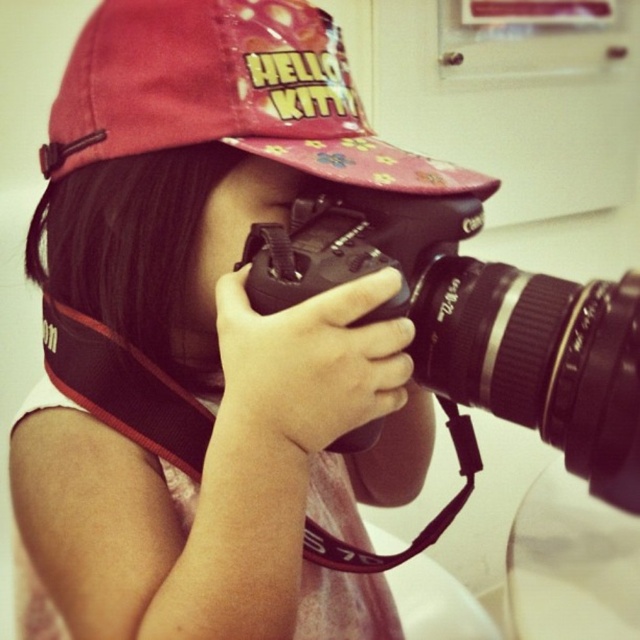
Find the location of a particular element. The image size is (640, 640). black plastic camera at center is located at coordinates (476, 323).

How far apart are black plastic camera at center and pink fabric cap at upper center?

4.00 inches

Is point (548, 304) farther from viewer compared to point (100, 113)?

No, (548, 304) is in front of (100, 113).

Image resolution: width=640 pixels, height=640 pixels. Find the location of `black plastic camera at center`. black plastic camera at center is located at coordinates coord(476,323).